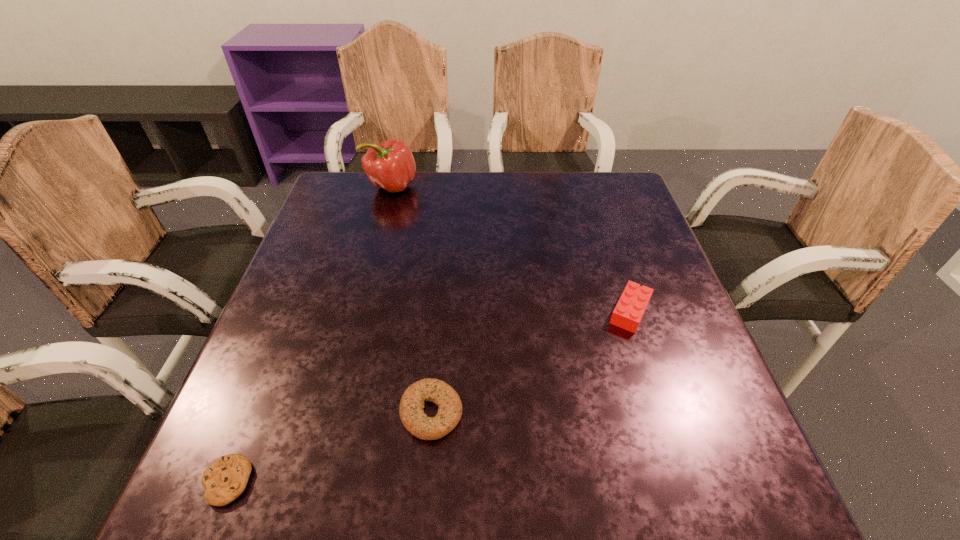
Where is `the farthest object`? Image resolution: width=960 pixels, height=540 pixels. the farthest object is located at coordinates (390, 165).

Where is `the tallest object`? the tallest object is located at coordinates (390, 165).

The image size is (960, 540). What are the coordinates of `the rightmost object` in the screenshot? It's located at (634, 300).

You are a GUI agent. You are given a task and a screenshot of the screen. Output one action in this format:
    pyautogui.click(x=<x>, y=<y>)
    Task: Click on the second farthest object
    This screenshot has height=540, width=960.
    Given the screenshot: What is the action you would take?
    pyautogui.click(x=634, y=300)

This screenshot has height=540, width=960. In order to click on the second nearest object in this screenshot , I will do `click(412, 415)`.

You are a GUI agent. You are given a task and a screenshot of the screen. Output one action in this format:
    pyautogui.click(x=<x>, y=<y>)
    Task: Click on the second object from right to left
    
    Given the screenshot: What is the action you would take?
    pyautogui.click(x=412, y=415)

Find the location of `cookie`. cookie is located at coordinates (225, 479).

The width and height of the screenshot is (960, 540). Identify the location of the leftmost object. (225, 479).

I want to click on vacant space located on the right of the pepper, so click(x=512, y=186).

Locate an element on the screen. The width and height of the screenshot is (960, 540). vacant space situated 0.060m on the back of the Lego is located at coordinates pyautogui.click(x=617, y=273).